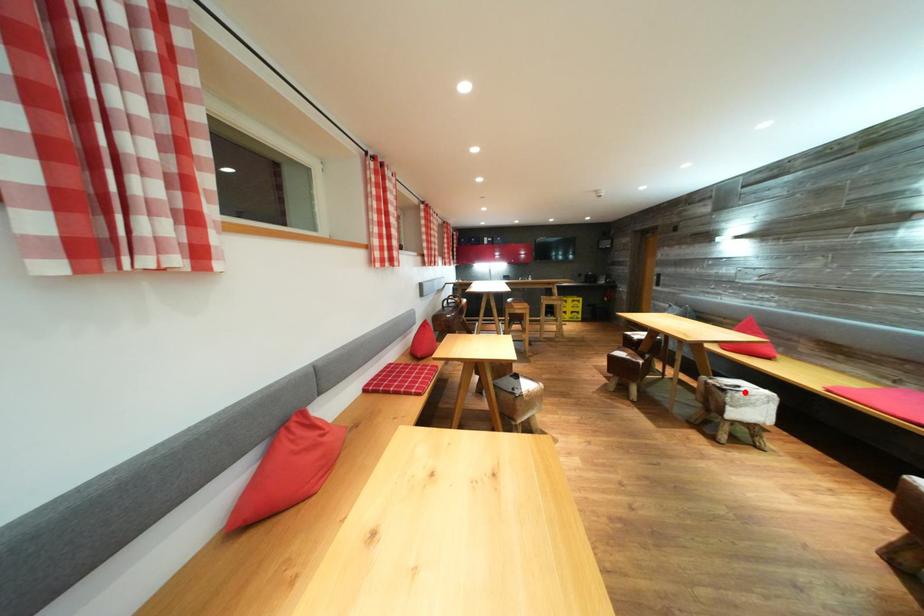
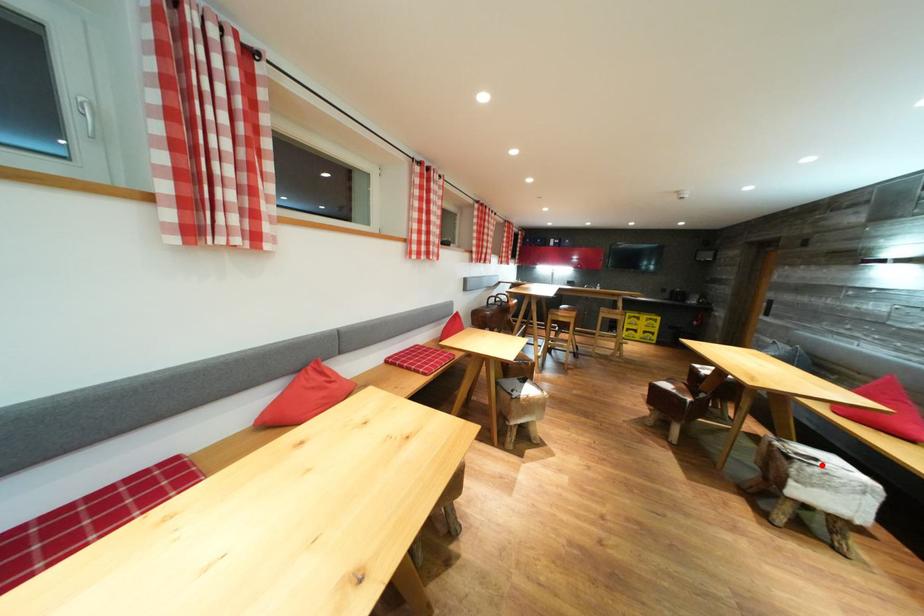
I am providing you with two images of the same scene from different viewpoints. A red point is marked on the first image and another point is marked on the second image. Are the points marked in image1 and image2 representing the same 3D position?

Yes